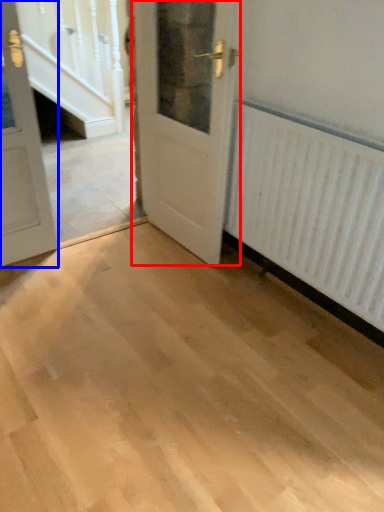
Question: Which of the following is the farthest to the observer, door (highlighted by a red box) or door (highlighted by a blue box)?

Choices:
 (A) door
 (B) door

Answer: (A)